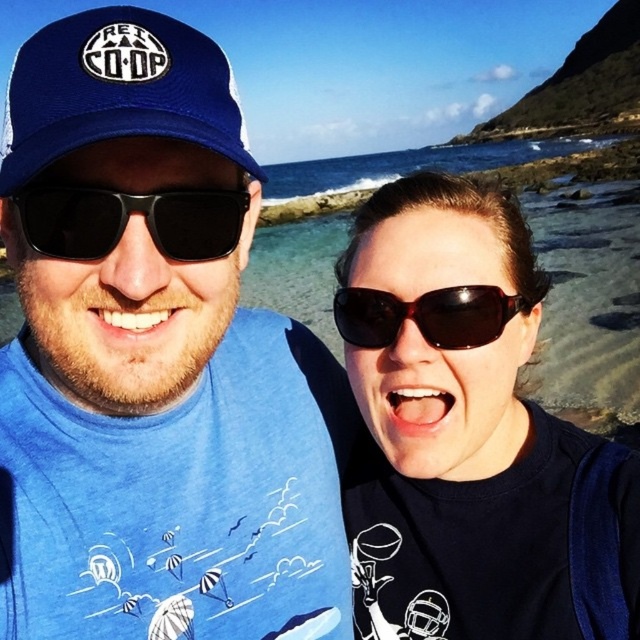
Question: Can you confirm if blue fabric shirt at center is positioned below matte black sunglasses at center?

Choices:
 (A) yes
 (B) no

Answer: (A)

Question: Does blue fabric baseball cap at upper left appear over brown matte sunglasses at center?

Choices:
 (A) no
 (B) yes

Answer: (B)

Question: Which of these objects is positioned farthest from the blue fabric shirt at center?

Choices:
 (A) brown matte sunglasses at center
 (B) black plastic sunglasses at left

Answer: (A)

Question: Which object is closer to the camera taking this photo?

Choices:
 (A) black plastic sunglasses at left
 (B) brown matte sunglasses at center
 (C) blue fabric baseball cap at upper left

Answer: (C)

Question: Among these objects, which one is farthest from the camera?

Choices:
 (A) blue fabric baseball cap at upper left
 (B) blue fabric shirt at center
 (C) black plastic sunglasses at left
 (D) brown matte sunglasses at center

Answer: (D)

Question: Where is blue fabric shirt at center located in relation to blue fabric baseball cap at upper left in the image?

Choices:
 (A) above
 (B) below

Answer: (B)